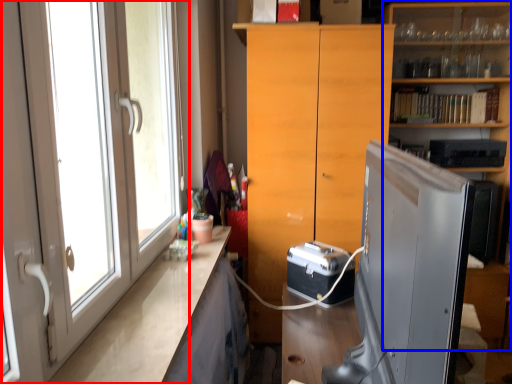
Question: Which object is closer to the camera taking this photo, door (highlighted by a red box) or shelf (highlighted by a blue box)?

Choices:
 (A) door
 (B) shelf

Answer: (A)